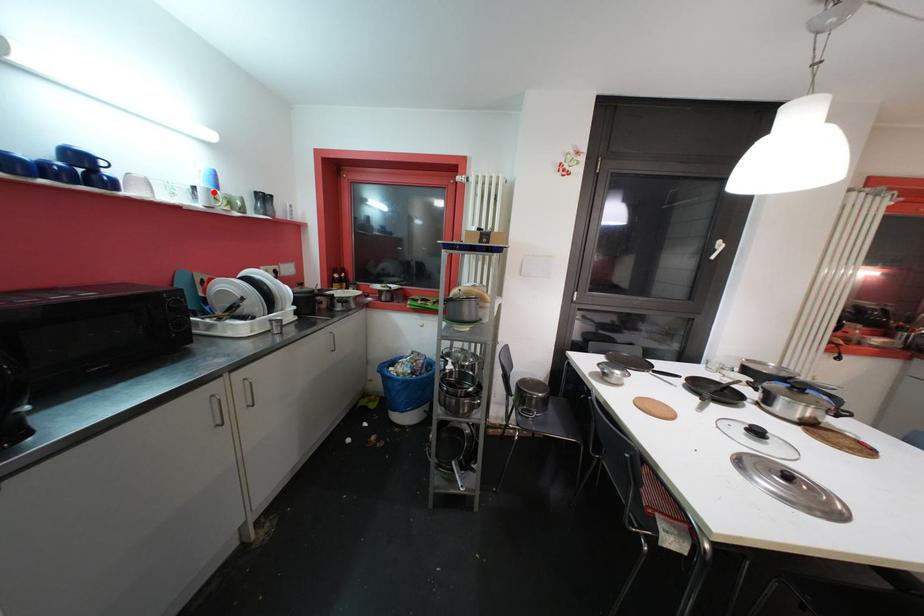
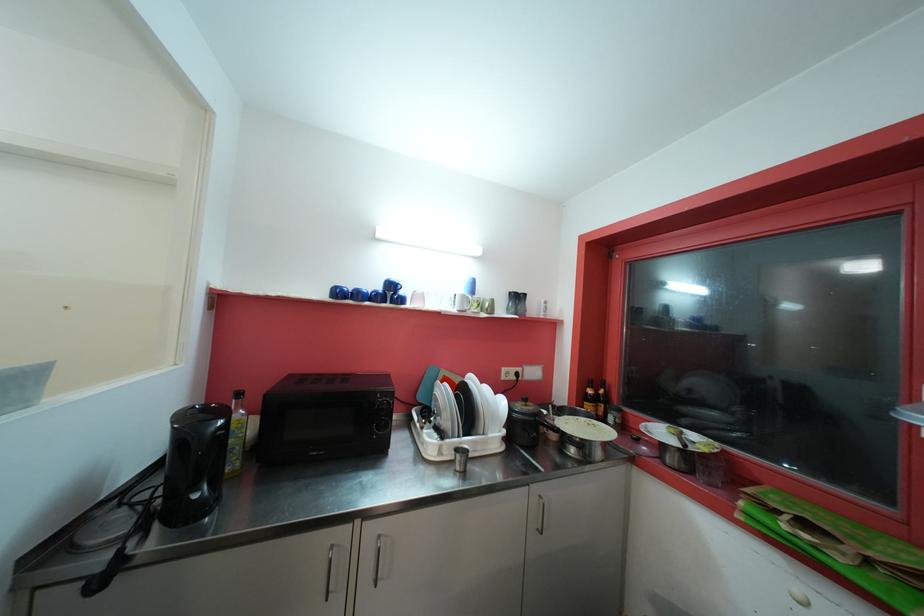
Locate, in the second image, the point that corresponds to the highlighted location in the first image.

(468, 299)